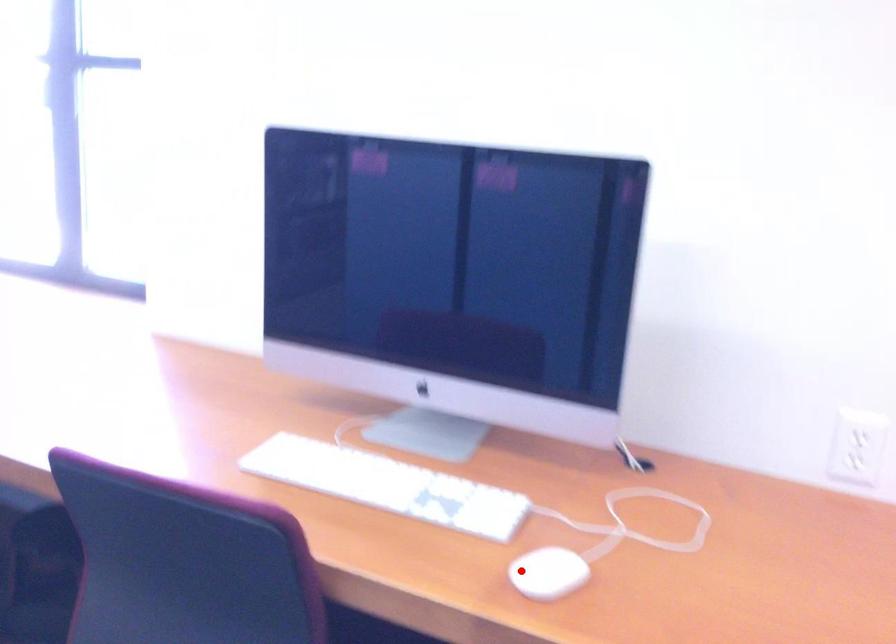
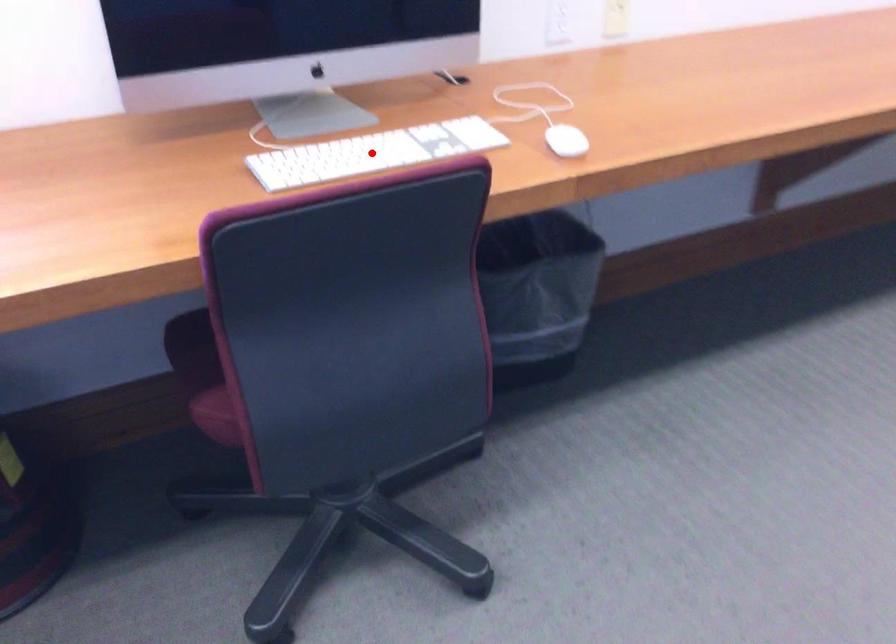
I am providing you with two images of the same scene from different viewpoints. A red point is marked on the first image and another point is marked on the second image. Are the points marked in image1 and image2 representing the same 3D position?

No